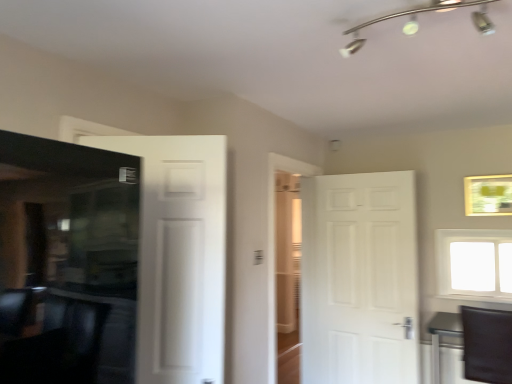
What do you see at coordinates (488, 195) in the screenshot?
I see `green matte picture frame at upper right` at bounding box center [488, 195].

Locate an element on the screen. The height and width of the screenshot is (384, 512). white matte door at right, the 2th door from the left is located at coordinates (359, 279).

Identify the location of white frosted glass window at upper right. (474, 264).

The width and height of the screenshot is (512, 384). I want to click on silver metallic track lighting at upper center, so click(417, 23).

Does green matte picture frame at upper right have a larger size compared to white matte door at left, acting as the second door starting from the back?

No, green matte picture frame at upper right is not bigger than white matte door at left, acting as the second door starting from the back.

Is green matte picture frame at upper right oriented towards white matte door at left, acting as the second door starting from the back?

No.

Which point is more forward, (470, 182) or (143, 262)?

The point (143, 262) is more forward.

Considering the positions of objects green matte picture frame at upper right and white matte door at left, acting as the second door starting from the back, in the image provided, who is behind, green matte picture frame at upper right or white matte door at left, acting as the second door starting from the back,?

green matte picture frame at upper right.

Does green matte picture frame at upper right turn towards silver metallic track lighting at upper center?

Yes, green matte picture frame at upper right is turned towards silver metallic track lighting at upper center.

Does green matte picture frame at upper right have a lesser height compared to silver metallic track lighting at upper center?

In fact, green matte picture frame at upper right may be taller than silver metallic track lighting at upper center.

From the image's perspective, is green matte picture frame at upper right positioned above or below silver metallic track lighting at upper center?

green matte picture frame at upper right is situated lower than silver metallic track lighting at upper center in the image.

The image size is (512, 384). What are the coordinates of `light fixture on the left of green matte picture frame at upper right` in the screenshot? It's located at (417, 23).

From the image's perspective, which one is positioned lower, white matte door at right, arranged as the 1th door when viewed from the back, or black leather swivel chair at lower right?

black leather swivel chair at lower right.

Considering the relative positions of white matte door at right, the 2th door from the front, and black leather swivel chair at lower right in the image provided, is white matte door at right, the 2th door from the front, to the left of black leather swivel chair at lower right from the viewer's perspective?

Correct, you'll find white matte door at right, the 2th door from the front, to the left of black leather swivel chair at lower right.

In terms of width, does white matte door at right, arranged as the 1th door when viewed from the back, look wider or thinner when compared to black leather swivel chair at lower right?

Clearly, white matte door at right, arranged as the 1th door when viewed from the back, has less width compared to black leather swivel chair at lower right.

Can white frosted glass window at upper right be found inside silver metallic track lighting at upper center?

No, silver metallic track lighting at upper center does not contain white frosted glass window at upper right.

Which object is more forward, silver metallic track lighting at upper center or white frosted glass window at upper right?

Positioned in front is silver metallic track lighting at upper center.

Between silver metallic track lighting at upper center and white frosted glass window at upper right, which one has larger size?

Bigger between the two is white frosted glass window at upper right.

In the scene shown: Is silver metallic track lighting at upper center inside or outside of white matte door at left, acting as the second door starting from the back?

The correct answer is: outside.

Is silver metallic track lighting at upper center taller than white matte door at left, marked as the second door in a right-to-left arrangement?

No, silver metallic track lighting at upper center is not taller than white matte door at left, marked as the second door in a right-to-left arrangement.

From a real-world perspective, is silver metallic track lighting at upper center physically located above or below white matte door at left, the 1th door positioned from the front?

Clearly, from a real-world perspective, silver metallic track lighting at upper center is above white matte door at left, the 1th door positioned from the front.

From the image's perspective, is silver metallic track lighting at upper center located above green matte picture frame at upper right?

Yes, from the image's perspective, silver metallic track lighting at upper center is over green matte picture frame at upper right.

In the scene shown: Is silver metallic track lighting at upper center shorter than green matte picture frame at upper right?

Correct, silver metallic track lighting at upper center is not as tall as green matte picture frame at upper right.

Does silver metallic track lighting at upper center appear on the right side of green matte picture frame at upper right?

Incorrect, silver metallic track lighting at upper center is not on the right side of green matte picture frame at upper right.

From a real-world perspective, between silver metallic track lighting at upper center and green matte picture frame at upper right, who is vertically lower?

In real-world perspective, green matte picture frame at upper right is lower.

Is white frosted glass window at upper right positioned with its back to black leather swivel chair at lower right?

No, white frosted glass window at upper right is not facing away from black leather swivel chair at lower right.

From a real-world perspective, is white frosted glass window at upper right physically below black leather swivel chair at lower right?

No, from a real-world perspective, white frosted glass window at upper right is not beneath black leather swivel chair at lower right.

Is white frosted glass window at upper right bigger than black leather swivel chair at lower right?

Incorrect, white frosted glass window at upper right is not larger than black leather swivel chair at lower right.

The image size is (512, 384). What are the coordinates of `door that is the 1st object directly below the green matte picture frame at upper right (from a real-world perspective)` in the screenshot? It's located at (179, 255).

The width and height of the screenshot is (512, 384). I want to click on picture frame on the right of silver metallic track lighting at upper center, so click(488, 195).

Looking at the image, which one is located closer to black leather swivel chair at lower right, white matte door at right, which ranks as the first door in right-to-left order, or white frosted glass window at upper right?

white frosted glass window at upper right.

Estimate the real-world distances between objects in this image. Which object is further from white frosted glass window at upper right, white matte door at right, which ranks as the first door in right-to-left order, or black leather swivel chair at lower right?

black leather swivel chair at lower right is positioned further to the anchor white frosted glass window at upper right.

From the image, which object appears to be farther from white matte door at left, acting as the second door starting from the back, white frosted glass window at upper right or silver metallic track lighting at upper center?

Among the two, white frosted glass window at upper right is located further to white matte door at left, acting as the second door starting from the back.

Which object lies further to the anchor point white matte door at right, the 2th door from the left, white matte door at left, acting as the 1th door starting from the left, or silver metallic track lighting at upper center?

The object further to white matte door at right, the 2th door from the left, is silver metallic track lighting at upper center.

Based on their spatial positions, is white frosted glass window at upper right or silver metallic track lighting at upper center closer to white matte door at right, the 2th door from the left?

white frosted glass window at upper right.

Consider the image. Looking at the image, which one is located closer to black leather swivel chair at lower right, white matte door at right, which ranks as the first door in right-to-left order, or silver metallic track lighting at upper center?

The object closer to black leather swivel chair at lower right is white matte door at right, which ranks as the first door in right-to-left order.

Based on their spatial positions, is white frosted glass window at upper right or black leather swivel chair at lower right closer to white matte door at right, arranged as the 1th door when viewed from the back?

white frosted glass window at upper right.

Based on their spatial positions, is black leather swivel chair at lower right or white frosted glass window at upper right closer to green matte picture frame at upper right?

The object closer to green matte picture frame at upper right is white frosted glass window at upper right.

Image resolution: width=512 pixels, height=384 pixels. I want to click on window between white matte door at left, marked as the second door in a right-to-left arrangement, and green matte picture frame at upper right from left to right, so click(x=474, y=264).

Identify the location of swivel chair between white matte door at left, the 1th door positioned from the front, and white frosted glass window at upper right, in the horizontal direction. This screenshot has height=384, width=512. (487, 344).

The image size is (512, 384). Find the location of `swivel chair between silver metallic track lighting at upper center and white matte door at right, the 2th door from the left, along the z-axis`. swivel chair between silver metallic track lighting at upper center and white matte door at right, the 2th door from the left, along the z-axis is located at coordinates (487, 344).

Locate an element on the screen. The width and height of the screenshot is (512, 384). swivel chair between white matte door at right, arranged as the 1th door when viewed from the back, and white frosted glass window at upper right, in the horizontal direction is located at coordinates (487, 344).